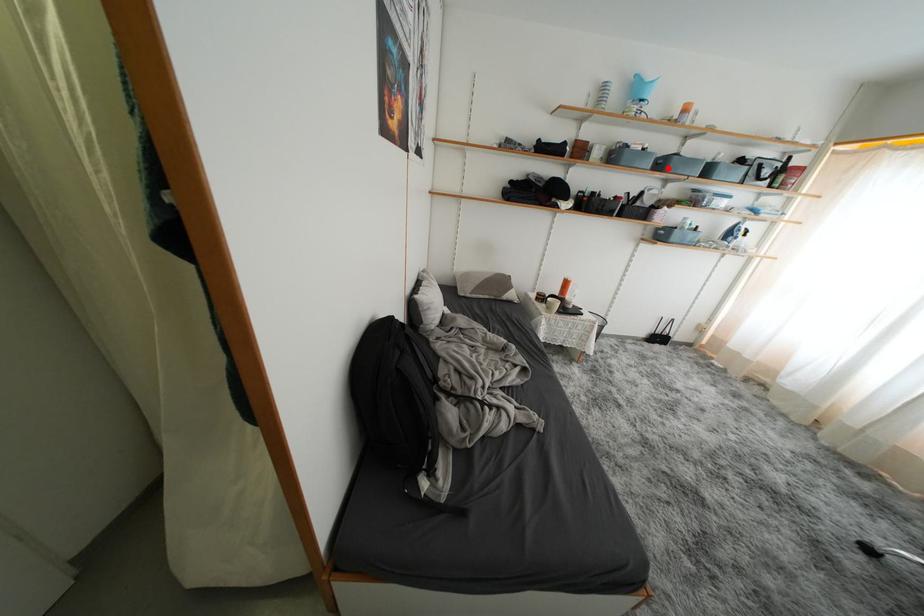
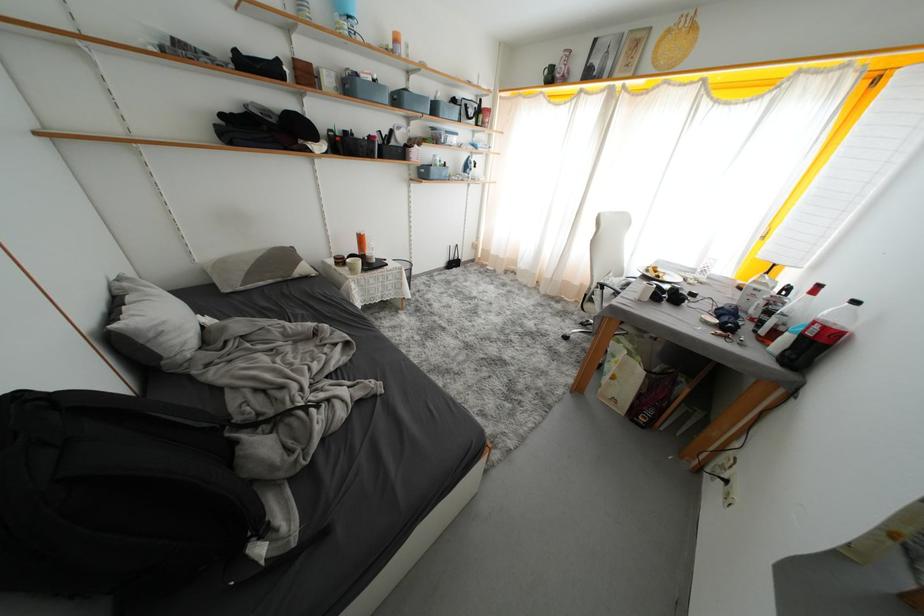
Where in the second image is the point corresponding to the highlighted location from the first image?

(404, 103)